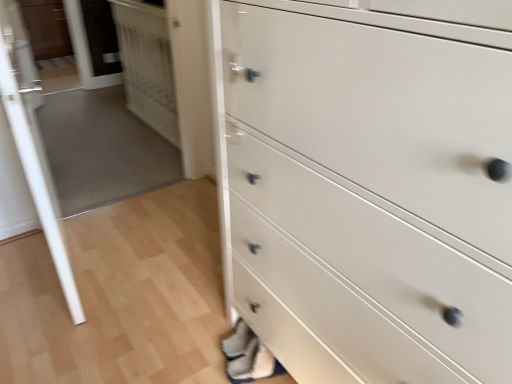
Where is `spots to the right of transparent glass door at left, the first glass door viewed from the front`? The height and width of the screenshot is (384, 512). spots to the right of transparent glass door at left, the first glass door viewed from the front is located at coordinates (154, 262).